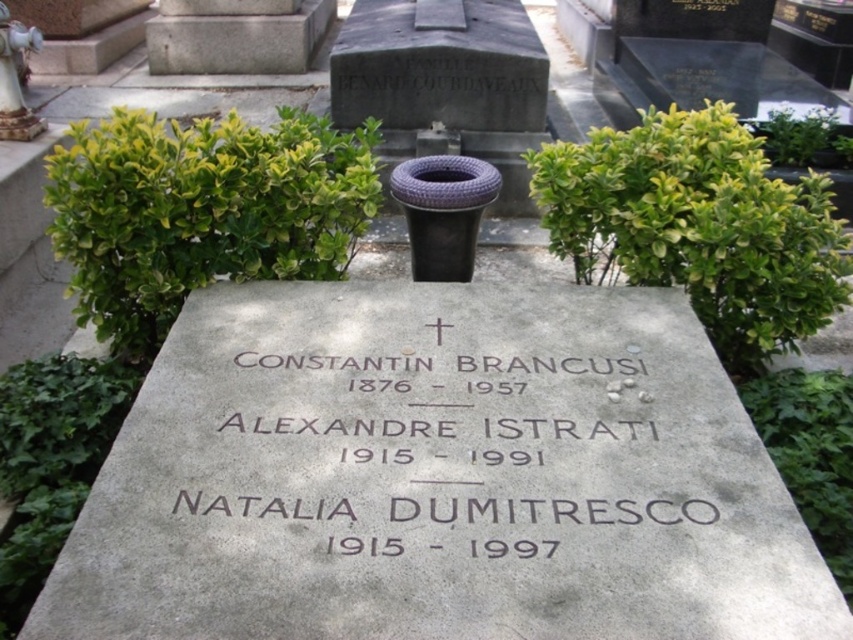
Question: Which of the following is the closest to the observer?

Choices:
 (A) (263, 360)
 (B) (9, 100)
 (C) (213, 58)

Answer: (A)

Question: Is gray stone engraving at center thinner than white ceramic statue at upper left?

Choices:
 (A) no
 (B) yes

Answer: (A)

Question: Which of the following is the farthest from the observer?

Choices:
 (A) (166, 45)
 (B) (4, 122)

Answer: (A)

Question: Can you confirm if gray stone engraving at center is positioned to the left of gray stone at upper center?

Choices:
 (A) yes
 (B) no

Answer: (B)

Question: Which point is farther from the camera taking this photo?

Choices:
 (A) (532, 424)
 (B) (16, 80)

Answer: (B)

Question: Is gray stone at upper center positioned before white ceramic statue at upper left?

Choices:
 (A) no
 (B) yes

Answer: (A)